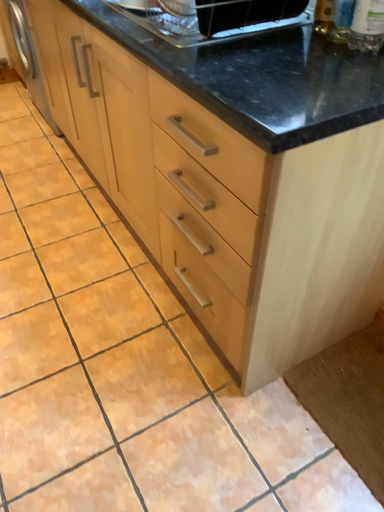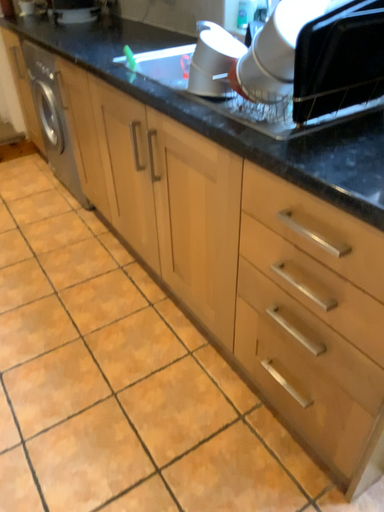
Question: Which way did the camera rotate in the video?

Choices:
 (A) rotated upward
 (B) rotated downward

Answer: (A)